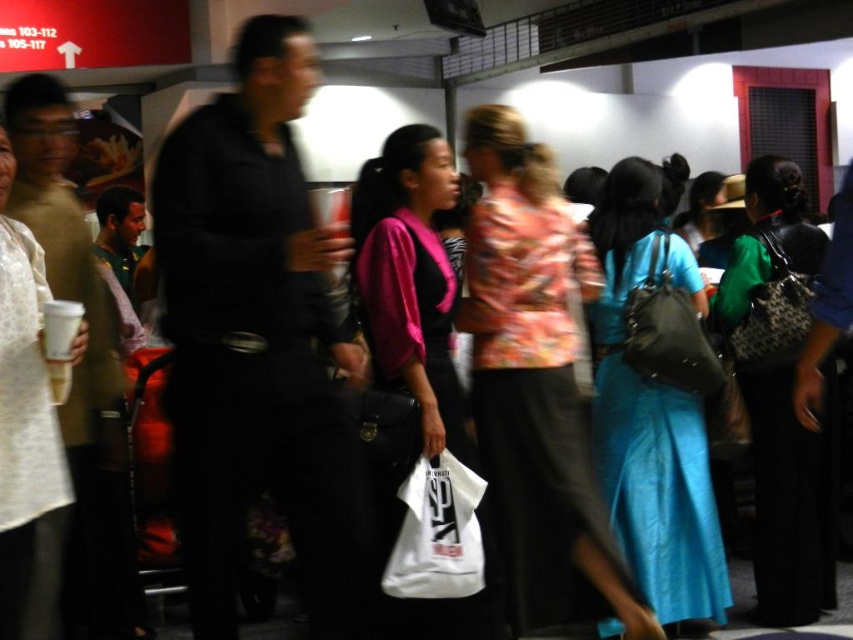
Is point (474, 164) farther from camera compared to point (704, 348)?

No.

Who is positioned more to the left, floral fabric blouse at center or matte black handbag at center?

Positioned to the left is floral fabric blouse at center.

Does point (515, 380) lie in front of point (646, 321)?

Yes, point (515, 380) is closer to viewer.

Image resolution: width=853 pixels, height=640 pixels. I want to click on floral fabric blouse at center, so click(x=537, y=385).

Is pink matte jacket at center behind white matte shirt at left?

Yes.

You are a GUI agent. You are given a task and a screenshot of the screen. Output one action in this format:
    pyautogui.click(x=<x>, y=<y>)
    Task: Click on the pink matte jacket at center
    Image resolution: width=853 pixels, height=640 pixels.
    Given the screenshot: What is the action you would take?
    pyautogui.click(x=405, y=314)

Can you confirm if floral fabric blouse at center is bigger than green textured dress at center?

Correct, floral fabric blouse at center is larger in size than green textured dress at center.

Can you confirm if floral fabric blouse at center is thinner than green textured dress at center?

In fact, floral fabric blouse at center might be wider than green textured dress at center.

Who is more distant from viewer, [515,340] or [775,234]?

Point [775,234]

The image size is (853, 640). I want to click on floral fabric blouse at center, so click(x=537, y=385).